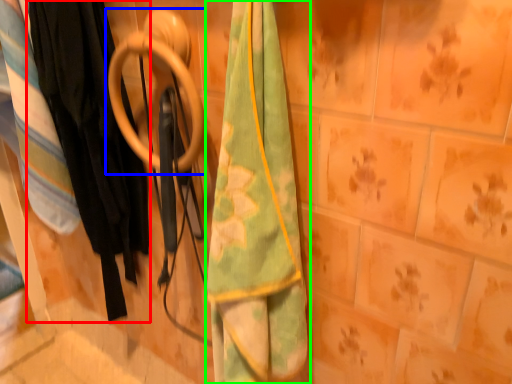
Question: Which is nearer to the clothing (highlighted by a red box)? door handle (highlighted by a blue box) or towel (highlighted by a green box).

Choices:
 (A) door handle
 (B) towel

Answer: (A)